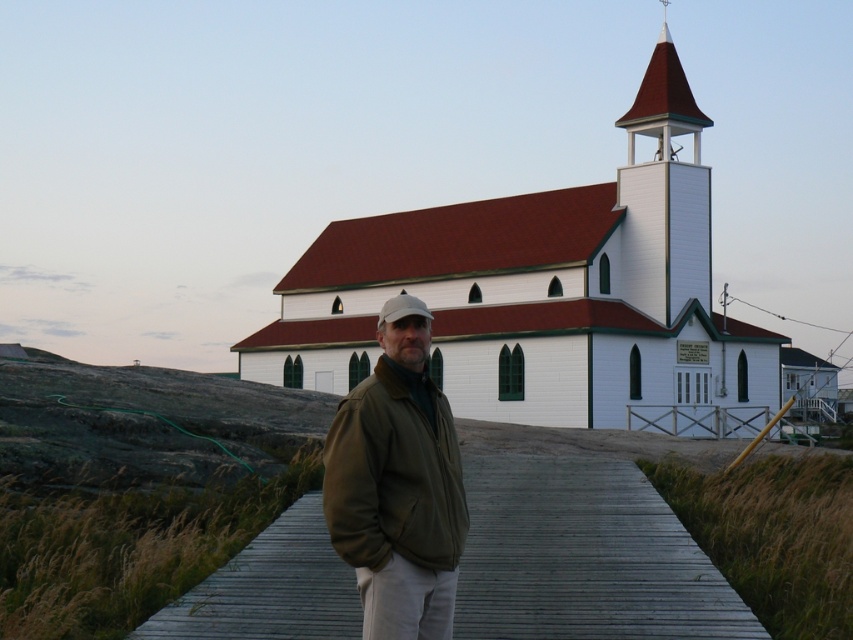
Which is above, wooden at center or white wood spire at upper right?

Positioned higher is white wood spire at upper right.

Locate an element on the screen. This screenshot has width=853, height=640. wooden at center is located at coordinates (583, 556).

Between point (753, 637) and point (631, 140), which one is positioned behind?

Positioned behind is point (631, 140).

Find the location of a particular element. wooden at center is located at coordinates (583, 556).

Is white wood church at center bigger than white wood spire at upper right?

Correct, white wood church at center is larger in size than white wood spire at upper right.

Consider the image. Between white wood church at center and white wood spire at upper right, which one appears on the right side from the viewer's perspective?

Positioned to the right is white wood spire at upper right.

Find the location of a particular element. The width and height of the screenshot is (853, 640). white wood church at center is located at coordinates (544, 296).

Where is `white wood church at center`? The image size is (853, 640). white wood church at center is located at coordinates (544, 296).

Can you confirm if wooden at center is taller than matte brown jacket at center?

In fact, wooden at center may be shorter than matte brown jacket at center.

Between wooden at center and matte brown jacket at center, which one appears on the right side from the viewer's perspective?

wooden at center

Does point (532, 566) lie behind point (415, 616)?

Yes.

Find the location of a particular element. wooden at center is located at coordinates (583, 556).